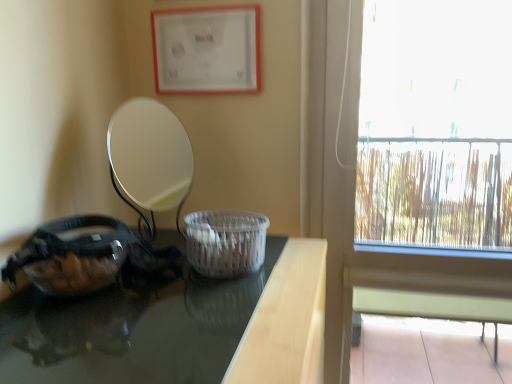
Question: Based on their sizes in the image, would you say transparent glass window at right is bigger or smaller than transparent glass bowl at left?

Choices:
 (A) small
 (B) big

Answer: (B)

Question: Is transparent glass window at right taller or shorter than transparent glass bowl at left?

Choices:
 (A) short
 (B) tall

Answer: (B)

Question: Estimate the real-world distances between objects in this image. Which object is farther from the white woven basket at center?

Choices:
 (A) transparent glass bowl at left
 (B) transparent glass window at right
 (C) black glossy table at left
 (D) matte white picture frame at upper center

Answer: (B)

Question: Considering the real-world distances, which object is farthest from the matte white picture frame at upper center?

Choices:
 (A) black glossy table at left
 (B) transparent glass window at right
 (C) white woven basket at center
 (D) transparent glass bowl at left

Answer: (B)